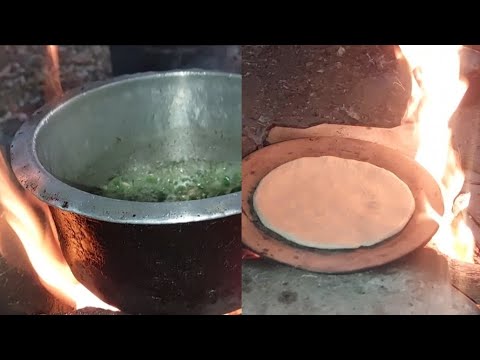
The width and height of the screenshot is (480, 360). I want to click on metal bowl, so click(x=130, y=217), click(x=37, y=138), click(x=158, y=107).